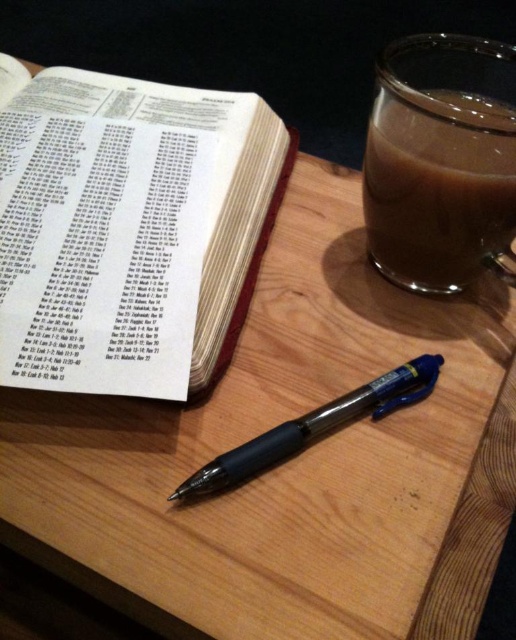
Question: Is white paper book at upper left closer to the viewer compared to brown translucent mug at upper right?

Choices:
 (A) yes
 (B) no

Answer: (A)

Question: Which object appears farthest from the camera in this image?

Choices:
 (A) white paper book at upper left
 (B) black plastic pen at center

Answer: (A)

Question: Which point is farther from the camera taking this photo?

Choices:
 (A) (39, 136)
 (B) (479, 147)
 (C) (288, 424)

Answer: (A)

Question: Which point is farther to the camera?

Choices:
 (A) (148, 113)
 (B) (398, 368)
 (C) (367, 218)

Answer: (A)

Question: Does white paper book at upper left have a larger size compared to brown translucent mug at upper right?

Choices:
 (A) no
 (B) yes

Answer: (B)

Question: Is white paper book at upper left positioned behind brown translucent mug at upper right?

Choices:
 (A) yes
 (B) no

Answer: (B)